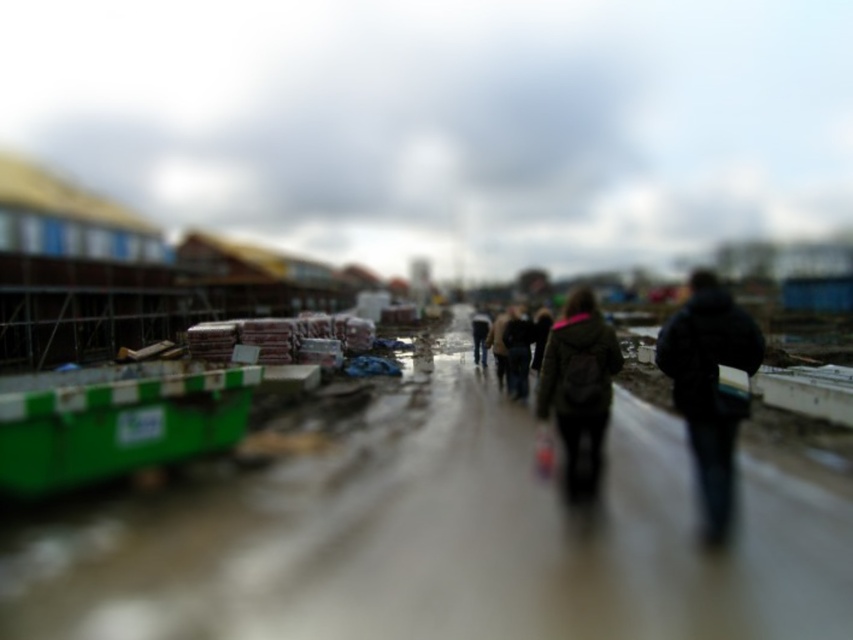
Who is positioned more to the left, black matte jacket at right or dark green jacket at center?

dark green jacket at center is more to the left.

Where is `black matte jacket at right`? black matte jacket at right is located at coordinates (709, 388).

Between green plastic containers at left and dark green jacket at center, which one is positioned higher?

dark green jacket at center

Between green plastic containers at left and dark green jacket at center, which one appears on the left side from the viewer's perspective?

From the viewer's perspective, green plastic containers at left appears more on the left side.

Who is more forward, (662, 420) or (581, 349)?

Point (581, 349)

At what (x,y) coordinates should I click in order to perform the action: click on green plastic containers at left. Please return your answer as a coordinate pair (x, y). This screenshot has width=853, height=640. Looking at the image, I should click on (432, 536).

Who is higher up, green plastic containers at left or black matte jacket at right?

Positioned higher is black matte jacket at right.

Identify the location of green plastic containers at left. The width and height of the screenshot is (853, 640). (432, 536).